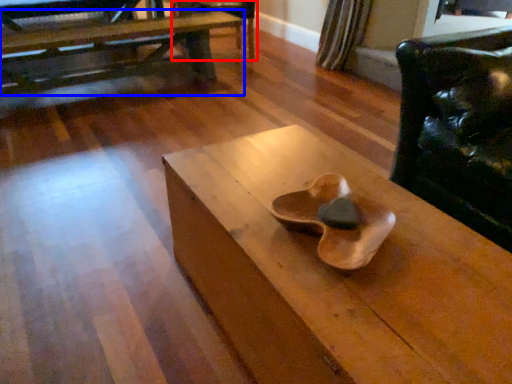
Question: Among these objects, which one is nearest to the camera, armchair (highlighted by a red box) or table (highlighted by a blue box)?

Choices:
 (A) armchair
 (B) table

Answer: (B)